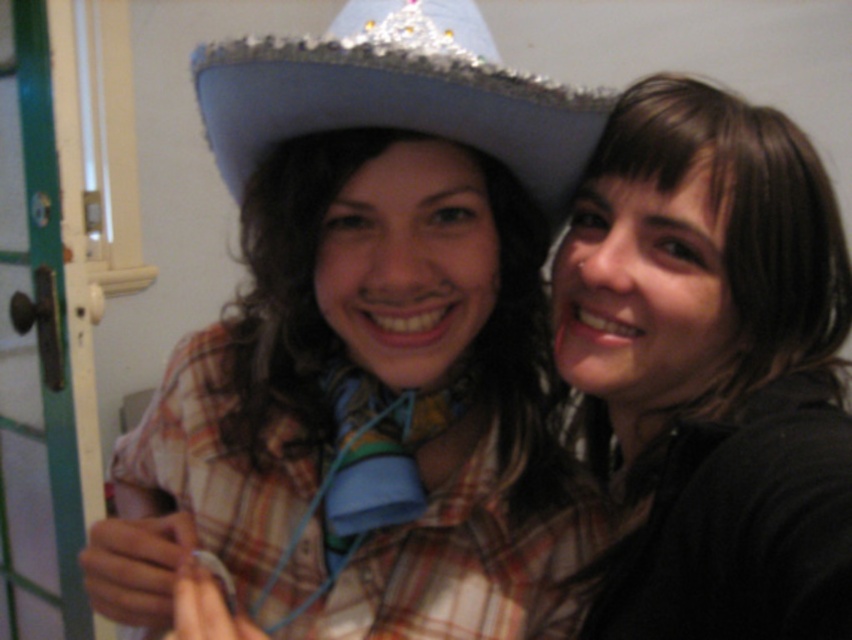
Question: Which point appears closest to the camera in this image?

Choices:
 (A) (639, 380)
 (B) (373, 26)

Answer: (B)

Question: Does matte blue hat at center have a greater width compared to shiny silver sombrero at upper center?

Choices:
 (A) no
 (B) yes

Answer: (B)

Question: Which point appears farthest from the camera in this image?

Choices:
 (A) click(x=550, y=220)
 (B) click(x=329, y=330)
 (C) click(x=720, y=241)

Answer: (B)

Question: Which point is closer to the camera?

Choices:
 (A) shiny silver sombrero at upper center
 (B) brown matte hair at upper right
 (C) matte blue hat at center

Answer: (B)

Question: Is matte blue hat at center further to the viewer compared to shiny silver sombrero at upper center?

Choices:
 (A) no
 (B) yes

Answer: (B)

Question: Is matte blue hat at center thinner than brown matte hair at upper right?

Choices:
 (A) yes
 (B) no

Answer: (B)